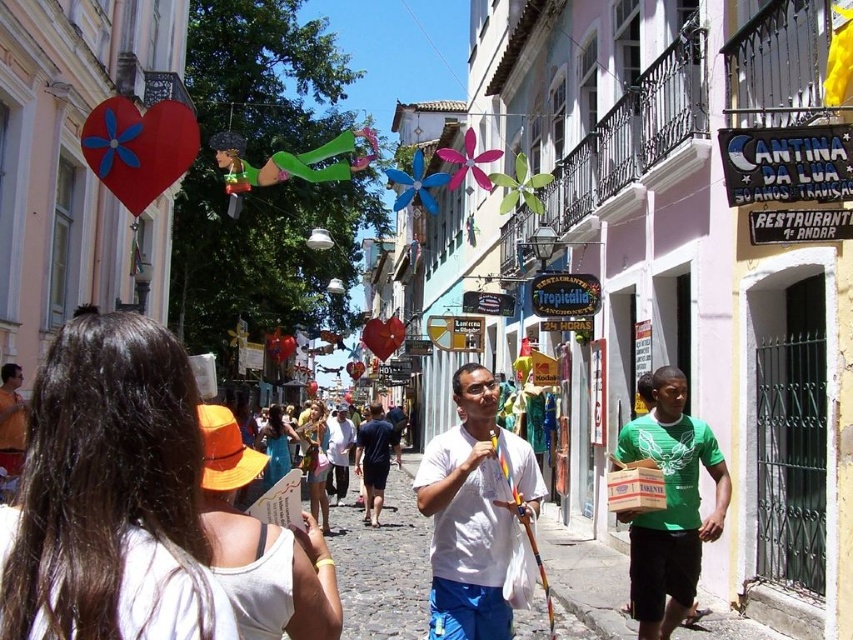
Question: Which point appears closest to the camera in this image?

Choices:
 (A) pos(697,509)
 (B) pos(363,483)
 (C) pos(50,413)

Answer: (C)

Question: Observing the image, what is the correct spatial positioning of white matte t-shirt at center in reference to green matte t-shirt at right?

Choices:
 (A) left
 (B) right

Answer: (A)

Question: Estimate the real-world distances between objects in this image. Which object is farther from the white matte t-shirt at center?

Choices:
 (A) matte white t-shirt at center
 (B) denim shorts at center

Answer: (A)

Question: Estimate the real-world distances between objects in this image. Which object is closer to the blue denim shorts at center?

Choices:
 (A) matte white t-shirt at center
 (B) orange fabric hat at center
 (C) white cotton shirt at center

Answer: (C)

Question: Does denim shorts at center appear on the right side of blue denim shorts at center?

Choices:
 (A) no
 (B) yes

Answer: (B)

Question: Is white cotton shirt at center positioned before blue denim shorts at center?

Choices:
 (A) yes
 (B) no

Answer: (B)